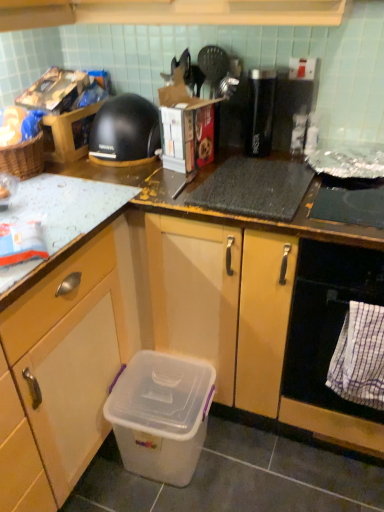
Question: Is the position of black glossy thermos at upper center, which appears as the 2th appliance when viewed from the right, less distant than that of black plastic toaster at upper right, marked as the first appliance in a right-to-left arrangement?

Choices:
 (A) yes
 (B) no

Answer: (A)

Question: From the image's perspective, does black glossy thermos at upper center, positioned as the 1th appliance in left-to-right order, appear higher than black plastic toaster at upper right, marked as the first appliance in a right-to-left arrangement?

Choices:
 (A) yes
 (B) no

Answer: (A)

Question: Is black glossy thermos at upper center, which appears as the 2th appliance when viewed from the right, outside of black plastic toaster at upper right, marked as the first appliance in a right-to-left arrangement?

Choices:
 (A) no
 (B) yes

Answer: (B)

Question: Does black glossy thermos at upper center, which appears as the 2th appliance when viewed from the right, appear on the left side of black plastic toaster at upper right, marked as the first appliance in a right-to-left arrangement?

Choices:
 (A) yes
 (B) no

Answer: (A)

Question: Can you confirm if black glossy thermos at upper center, which appears as the 2th appliance when viewed from the right, is shorter than black plastic toaster at upper right, which ranks as the second appliance in left-to-right order?

Choices:
 (A) yes
 (B) no

Answer: (B)

Question: Is black glossy thermos at upper center, positioned as the 1th appliance in left-to-right order, behind black plastic toaster at upper right, marked as the first appliance in a right-to-left arrangement?

Choices:
 (A) yes
 (B) no

Answer: (B)

Question: From the image's perspective, is transparent plastic storage box at lower left under black matte coffee maker at upper left?

Choices:
 (A) yes
 (B) no

Answer: (A)

Question: From the image's perspective, does transparent plastic storage box at lower left appear higher than black matte coffee maker at upper left?

Choices:
 (A) no
 (B) yes

Answer: (A)

Question: Is transparent plastic storage box at lower left outside of black matte coffee maker at upper left?

Choices:
 (A) no
 (B) yes

Answer: (B)

Question: Is black matte coffee maker at upper left at the back of transparent plastic storage box at lower left?

Choices:
 (A) no
 (B) yes

Answer: (A)

Question: Is the surface of transparent plastic storage box at lower left in direct contact with black matte coffee maker at upper left?

Choices:
 (A) yes
 (B) no

Answer: (B)

Question: Could you tell me if transparent plastic storage box at lower left is turned towards black matte coffee maker at upper left?

Choices:
 (A) no
 (B) yes

Answer: (A)

Question: From the image's perspective, is black matte coffee maker at upper left beneath white checkered towel at lower right?

Choices:
 (A) no
 (B) yes

Answer: (A)